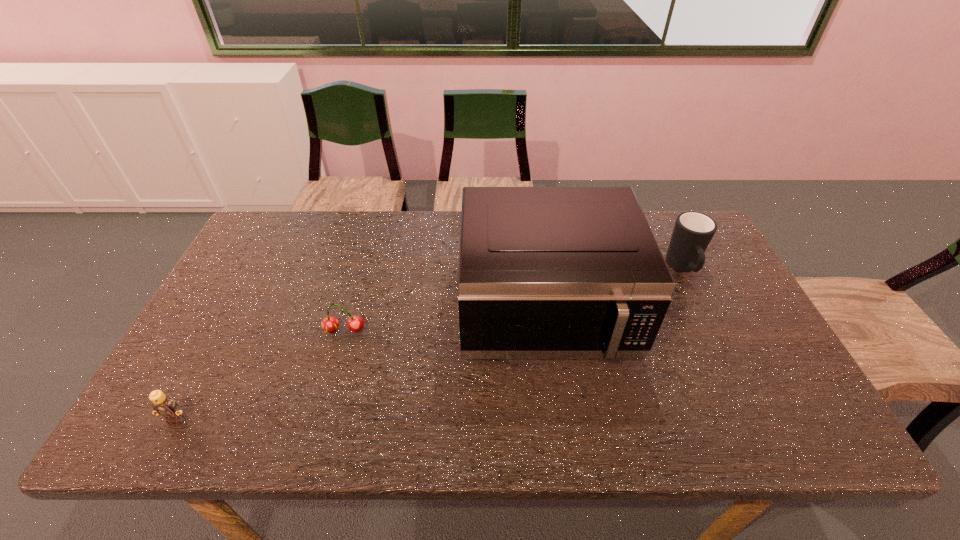
You are a GUI agent. You are given a task and a screenshot of the screen. Output one action in this format:
    pyautogui.click(x=<x>, y=<y>)
    Task: Click on the tallest object
    This screenshot has width=960, height=540.
    Given the screenshot: What is the action you would take?
    pos(544,272)

Locate an element on the screen. Image resolution: width=960 pixels, height=540 pixels. the second object from right to left is located at coordinates (544, 272).

Find the location of `the rightmost object`. the rightmost object is located at coordinates (693, 231).

Where is `the second tallest object`? the second tallest object is located at coordinates (693, 231).

This screenshot has width=960, height=540. Find the location of `the third object from right to left`. the third object from right to left is located at coordinates (355, 323).

This screenshot has width=960, height=540. In order to click on Lego in this screenshot , I will do `click(164, 405)`.

Image resolution: width=960 pixels, height=540 pixels. I want to click on the nearest object, so click(x=164, y=405).

This screenshot has width=960, height=540. In order to click on vacant region located 0.100m on the front-facing side of the tallest object in this screenshot , I will do [x=560, y=414].

This screenshot has height=540, width=960. In order to click on blank space located 0.200m on the side of the mug with the handle in this screenshot , I will do `click(719, 343)`.

Locate an element on the screen. The height and width of the screenshot is (540, 960). vacant point located with stems pointing upwards on the cherry is located at coordinates (334, 366).